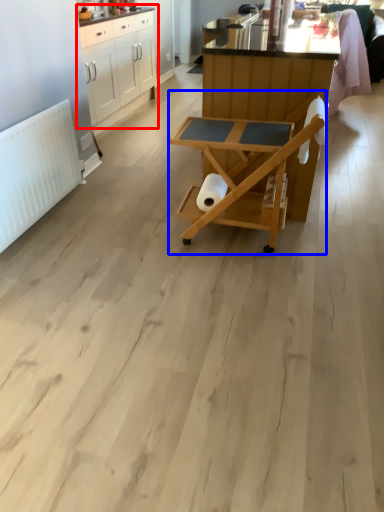
Question: Which object appears closest to the camera in this image, cabinetry (highlighted by a red box) or table (highlighted by a blue box)?

Choices:
 (A) cabinetry
 (B) table

Answer: (B)